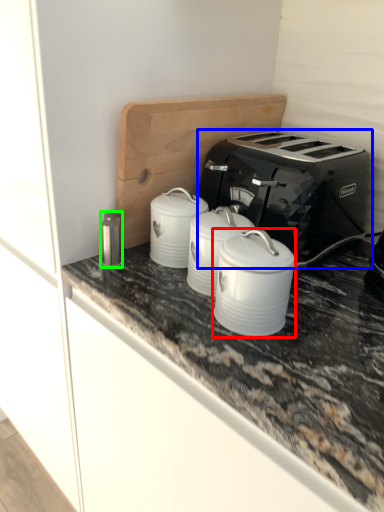
Question: Based on their relative distances, which object is farther from appliance (highlighted by a red box)? Choose from toaster (highlighted by a blue box) and appliance (highlighted by a green box).

Choices:
 (A) toaster
 (B) appliance

Answer: (B)